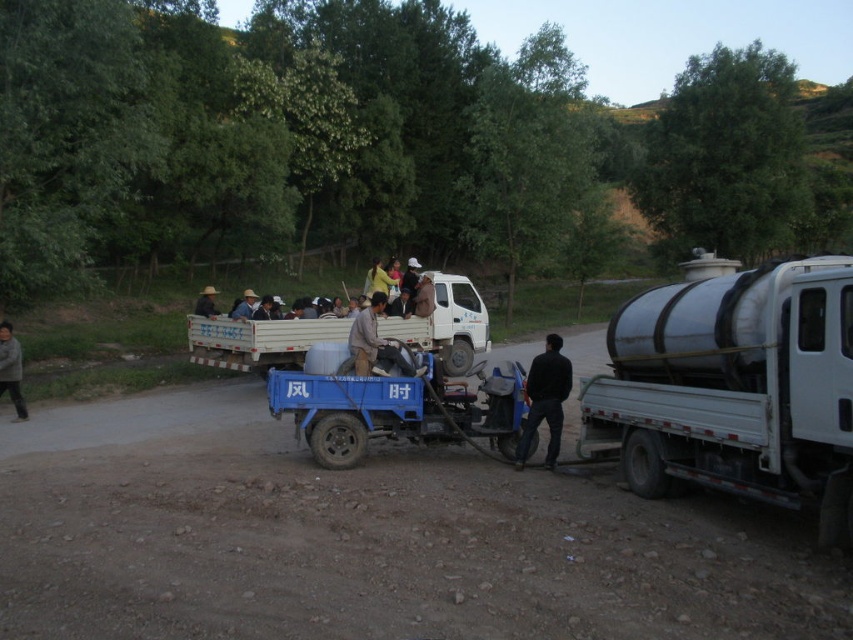
Does white matte truck at center have a lesser width compared to light brown fabric hat at center?

In fact, white matte truck at center might be wider than light brown fabric hat at center.

Who is shorter, white matte truck at center or light brown fabric hat at center?

light brown fabric hat at center is shorter.

Identify the location of white matte truck at center. The width and height of the screenshot is (853, 640). (259, 340).

Between point (532, 428) and point (212, 305), which one is positioned behind?

Point (212, 305)

Can you confirm if black matte person at center is wider than brown fabric hat at upper center?

Incorrect, black matte person at center's width does not surpass brown fabric hat at upper center's.

Find the location of a particular element. This screenshot has height=640, width=853. black matte person at center is located at coordinates (544, 400).

Does blue plastic wagon at center appear over white matte truck at center?

Incorrect, blue plastic wagon at center is not positioned above white matte truck at center.

At what (x,y) coordinates should I click in order to perform the action: click on blue plastic wagon at center. Please return your answer as a coordinate pair (x, y). The width and height of the screenshot is (853, 640). Looking at the image, I should click on (398, 410).